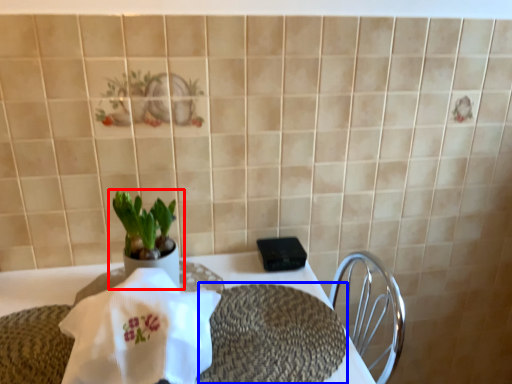
Question: Which object appears closest to the camera in this image, houseplant (highlighted by a red box) or place mat (highlighted by a blue box)?

Choices:
 (A) houseplant
 (B) place mat

Answer: (B)